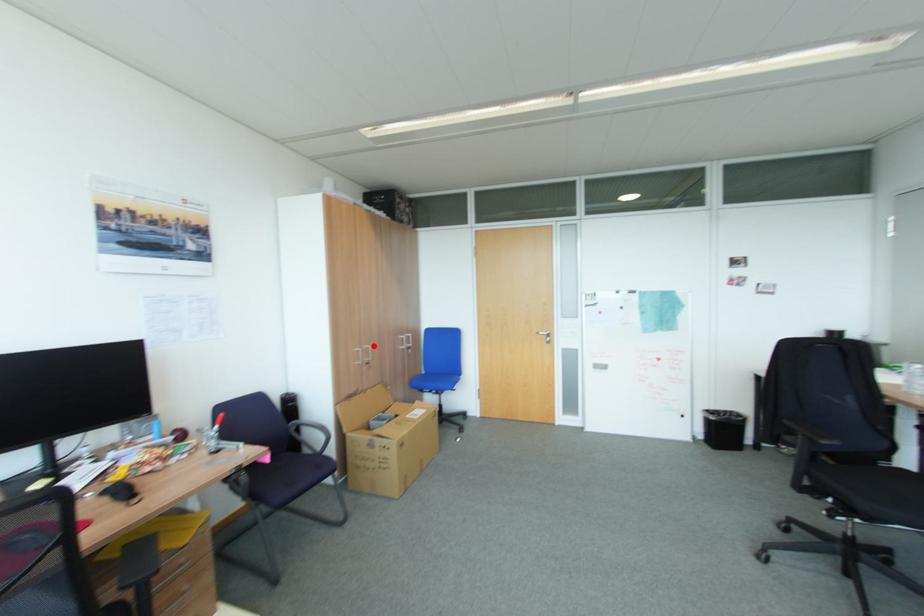
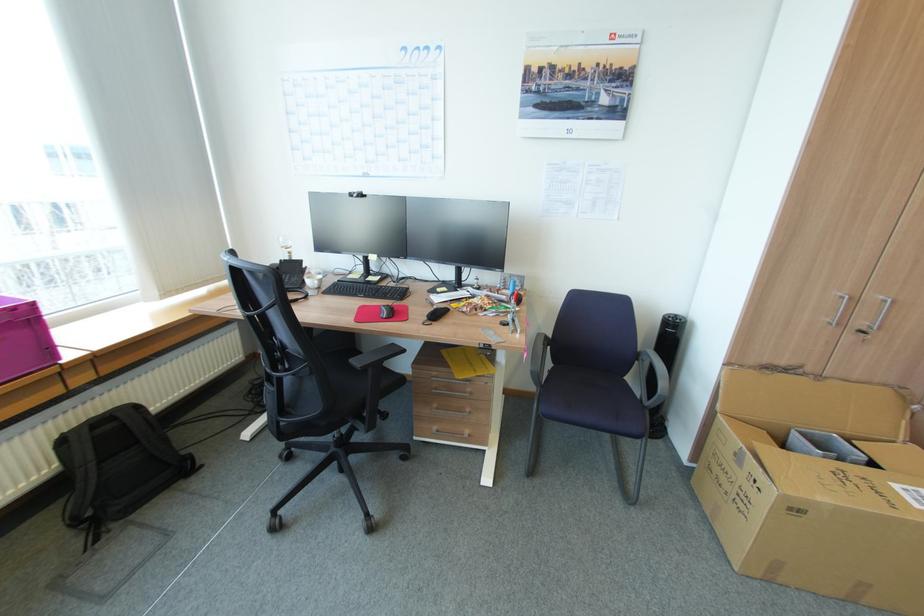
Find the pixel in the second image that matches the highlighted location in the first image.

(888, 297)